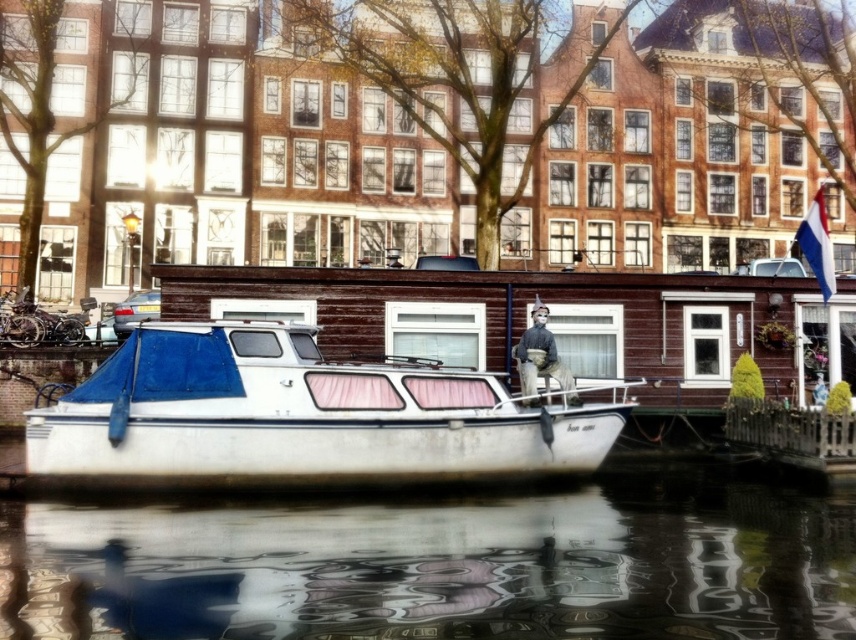
Consider the image. You are an architect designing a new canal house. You need to determine the placement of a reflective surface in your design based on the proportions observed in this scene. Which object, the glossy reflective water at lower center or the white matte boat at center, should you use as the reference for the size of your reflective surface?

The glossy reflective water at lower center is smaller than the white matte boat at center. Therefore, you should use the white matte boat at center as the reference for the size of your reflective surface since it is larger and would provide a more substantial area for reflection.

You are standing at the edge of the canal in the image. There is a point at coordinates point (438, 564). What is located at this point?

The point (438, 564) corresponds to the glossy reflective water at lower center in the scene.